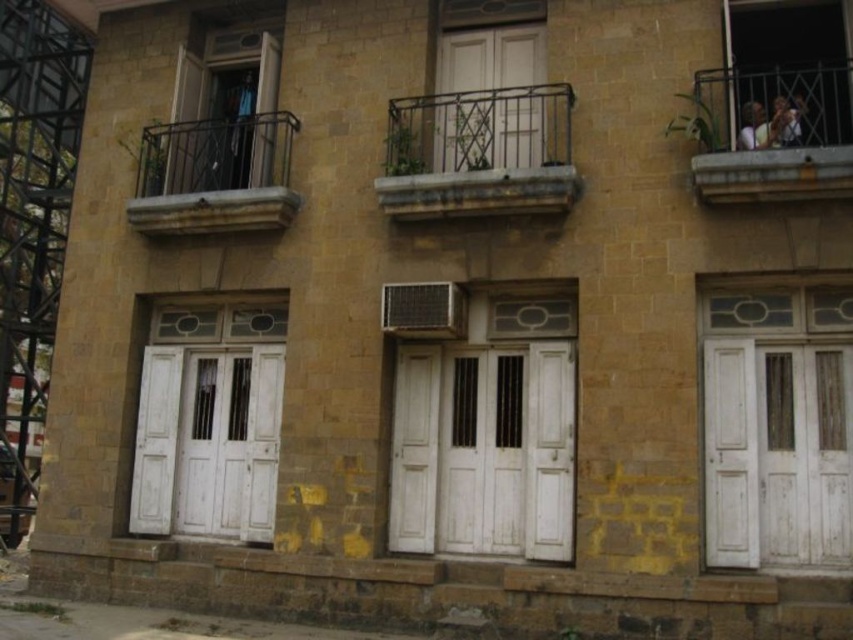
You are a maintenance worker needing to reach the white wooden door at left from the metallic black balcony at upper right. You have a ladder that is 5 meters long. Can you safely reach the door using the ladder?

The distance between the white wooden door at left and the metallic black balcony at upper right is 5.50 meters. Since the ladder is only 5 meters long, it is not long enough to safely bridge the gap between them.

You are standing in front of the building and want to determine which of the two points, point (166, 173) or point (759, 124), is closer to you. Based on the building facade, which point is nearer?

Point (166, 173) is closer to you because it is further to the viewer than point (759, 124).

You are standing in front of the building and want to move from the matte glass door at upper left to the light brown wooden chair at upper right. Which direction should you go?

The light brown wooden chair at upper right is behind the matte glass door at upper left, so you should go backward to reach it.